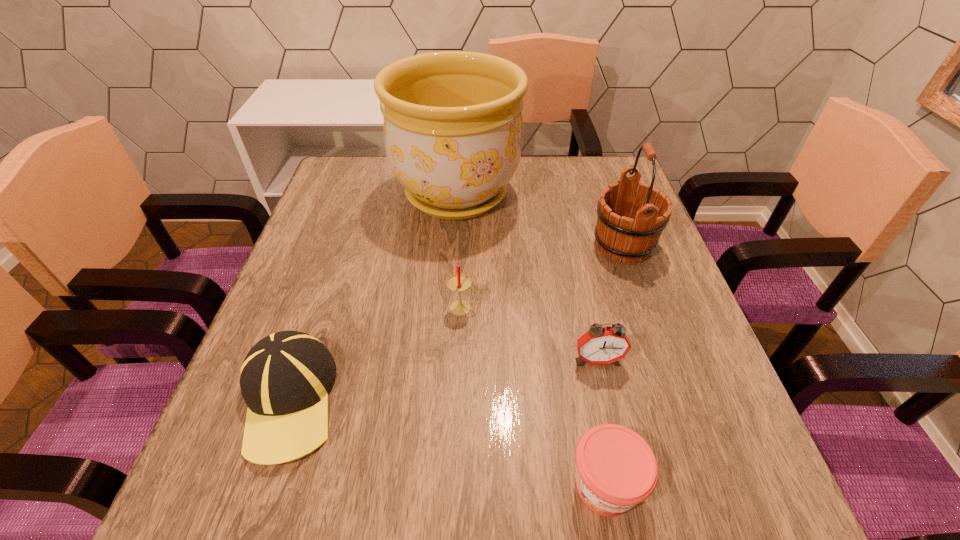
Find the location of a particular element. vacant region at the right edge of the desktop is located at coordinates (667, 334).

Image resolution: width=960 pixels, height=540 pixels. In the image, there is a desktop. Find the location of `vacant space at the far left corner`. vacant space at the far left corner is located at coordinates (377, 156).

The image size is (960, 540). I want to click on vacant space at the near left corner of the desktop, so 237,488.

Image resolution: width=960 pixels, height=540 pixels. Find the location of `empty location between the tallest object and the wine bucket`. empty location between the tallest object and the wine bucket is located at coordinates (540, 220).

Image resolution: width=960 pixels, height=540 pixels. I want to click on free area in between the candle and the alarm clock, so click(530, 334).

Find the location of a particular element. This screenshot has height=540, width=960. vacant space that is in between the jam and the leftmost object is located at coordinates (446, 443).

I want to click on free space between the alarm clock and the tallest object, so click(x=527, y=277).

Identify the location of free space between the second tallest object and the tallest object. This screenshot has height=540, width=960. (540, 220).

The height and width of the screenshot is (540, 960). Find the location of `vacant space that is in between the jam and the leftmost object`. vacant space that is in between the jam and the leftmost object is located at coordinates (446, 443).

The height and width of the screenshot is (540, 960). In order to click on free space between the fourth nearest object and the jam in this screenshot , I will do `click(534, 396)`.